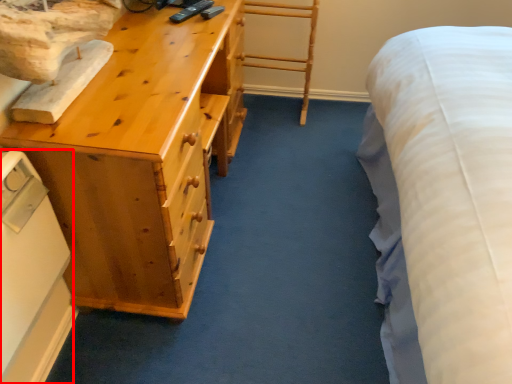
Question: Considering the relative positions of appliance (annotated by the red box) and chest of drawers in the image provided, where is appliance (annotated by the red box) located with respect to the staircase?

Choices:
 (A) right
 (B) left

Answer: (B)